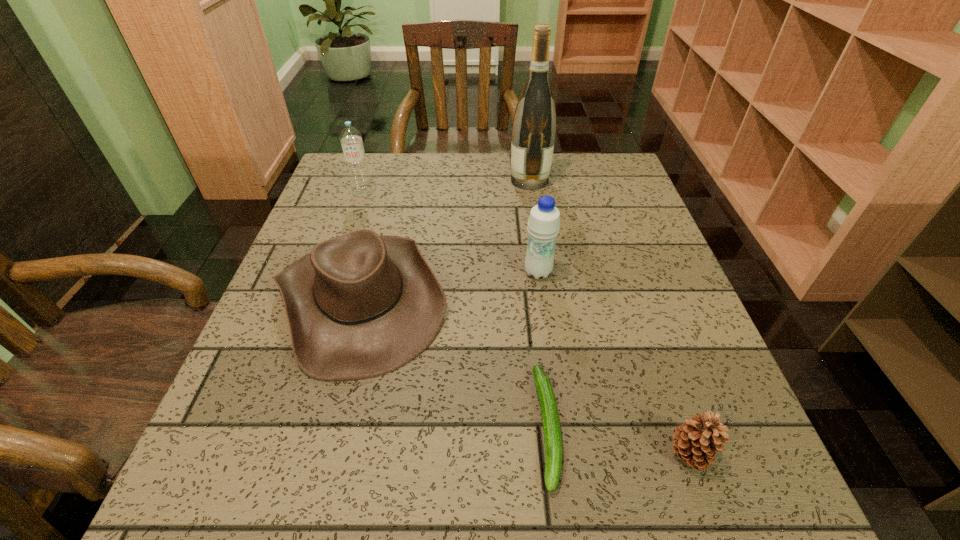
Where is `free space between the right water bottle and the rightmost object`? free space between the right water bottle and the rightmost object is located at coordinates (613, 363).

Locate an element on the screen. This screenshot has height=540, width=960. vacant point located between the pinecone and the left water bottle is located at coordinates (526, 323).

Locate an element on the screen. This screenshot has height=540, width=960. free space between the farther water bottle and the zucchini is located at coordinates (455, 309).

I want to click on free space between the farther water bottle and the nearer water bottle, so click(x=450, y=232).

The width and height of the screenshot is (960, 540). What are the coordinates of `unoccupied area between the pinecone and the cowboy hat` in the screenshot? It's located at (525, 376).

Where is `vacant space in between the wine bottle and the pinecone`? Image resolution: width=960 pixels, height=540 pixels. vacant space in between the wine bottle and the pinecone is located at coordinates (610, 317).

Image resolution: width=960 pixels, height=540 pixels. I want to click on unoccupied area between the left water bottle and the wine bottle, so click(446, 186).

Find the location of a particular element. empty location between the second shortest object and the nearer water bottle is located at coordinates (613, 363).

Identify the location of vacant space that is in between the nearer water bottle and the fourth tallest object. The height and width of the screenshot is (540, 960). (449, 286).

Where is `free space between the pinecone and the zucchini`? This screenshot has width=960, height=540. free space between the pinecone and the zucchini is located at coordinates 619,440.